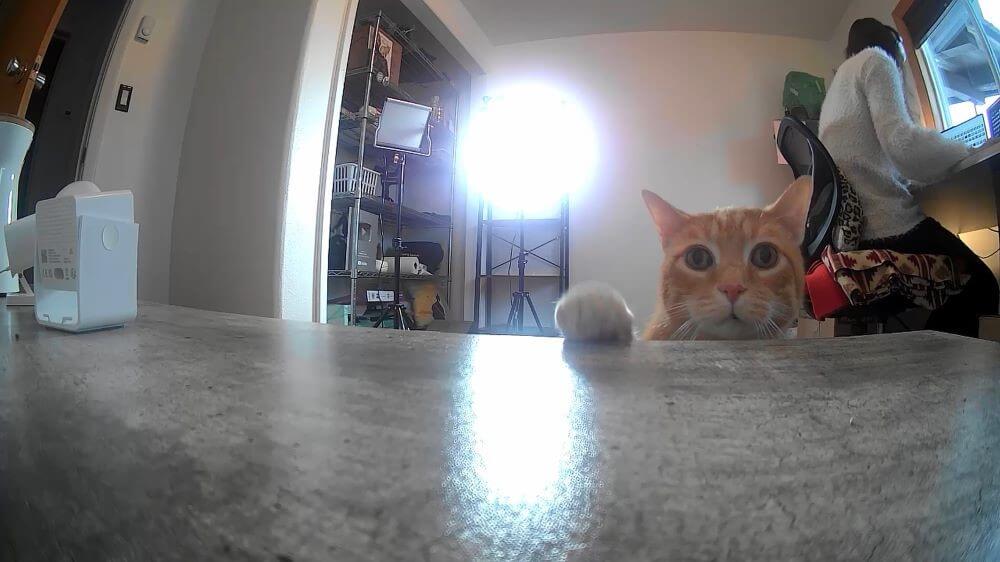
Identify the location of tissue roll. (409, 268).